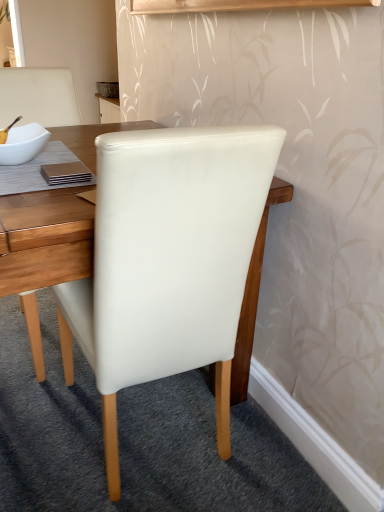
Question: Is white leather chair at center thinner than white glossy bowl at upper left?

Choices:
 (A) yes
 (B) no

Answer: (B)

Question: Is white leather chair at center positioned beyond the bounds of white glossy bowl at upper left?

Choices:
 (A) no
 (B) yes

Answer: (B)

Question: Considering the relative positions of white leather chair at center and white glossy bowl at upper left in the image provided, is white leather chair at center in front of white glossy bowl at upper left?

Choices:
 (A) no
 (B) yes

Answer: (B)

Question: Does white leather chair at center come behind white glossy bowl at upper left?

Choices:
 (A) no
 (B) yes

Answer: (A)

Question: From the image's perspective, is white leather chair at center located above white glossy bowl at upper left?

Choices:
 (A) no
 (B) yes

Answer: (A)

Question: Does white leather chair at center touch white glossy bowl at upper left?

Choices:
 (A) yes
 (B) no

Answer: (B)

Question: Can you confirm if white glossy bowl at upper left is positioned to the left of white leather chair at center?

Choices:
 (A) no
 (B) yes

Answer: (B)

Question: From a real-world perspective, is white glossy bowl at upper left located beneath white leather chair at center?

Choices:
 (A) yes
 (B) no

Answer: (B)

Question: From a real-world perspective, is white glossy bowl at upper left on top of white leather chair at center?

Choices:
 (A) yes
 (B) no

Answer: (A)

Question: Are white glossy bowl at upper left and white leather chair at center making contact?

Choices:
 (A) no
 (B) yes

Answer: (A)

Question: From the image's perspective, is white glossy bowl at upper left below white leather chair at center?

Choices:
 (A) yes
 (B) no

Answer: (B)

Question: Considering the relative sizes of white glossy bowl at upper left and white leather chair at center in the image provided, is white glossy bowl at upper left thinner than white leather chair at center?

Choices:
 (A) no
 (B) yes

Answer: (B)

Question: Considering the positions of white leather chair at center and white glossy bowl at upper left in the image, is white leather chair at center bigger or smaller than white glossy bowl at upper left?

Choices:
 (A) small
 (B) big

Answer: (B)